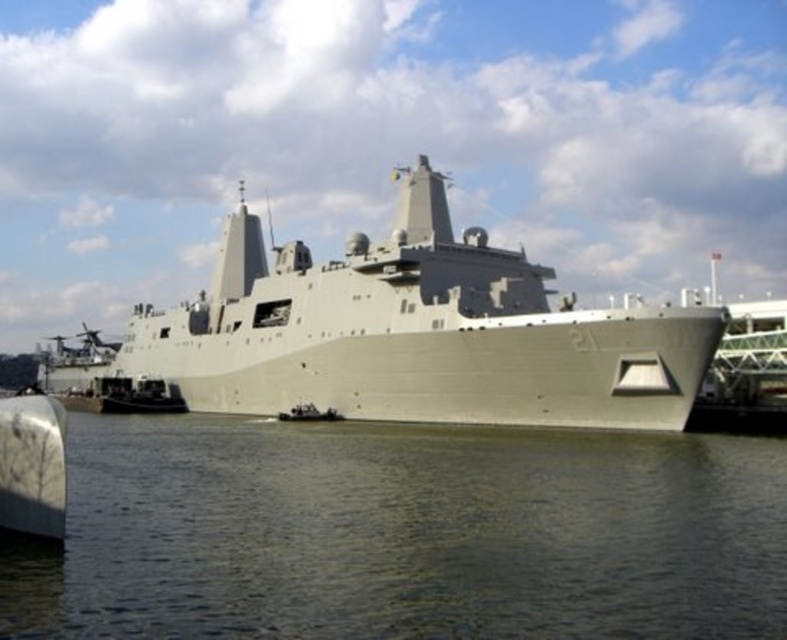
Is greenish water at lower center to the left of gray matte ship at center from the viewer's perspective?

No, greenish water at lower center is not to the left of gray matte ship at center.

Does greenish water at lower center appear over gray matte ship at center?

Incorrect, greenish water at lower center is not positioned above gray matte ship at center.

You are a GUI agent. You are given a task and a screenshot of the screen. Output one action in this format:
    pyautogui.click(x=<x>, y=<y>)
    Task: Click on the greenish water at lower center
    The width and height of the screenshot is (787, 640).
    Given the screenshot: What is the action you would take?
    pyautogui.click(x=403, y=532)

This screenshot has height=640, width=787. I want to click on greenish water at lower center, so click(403, 532).